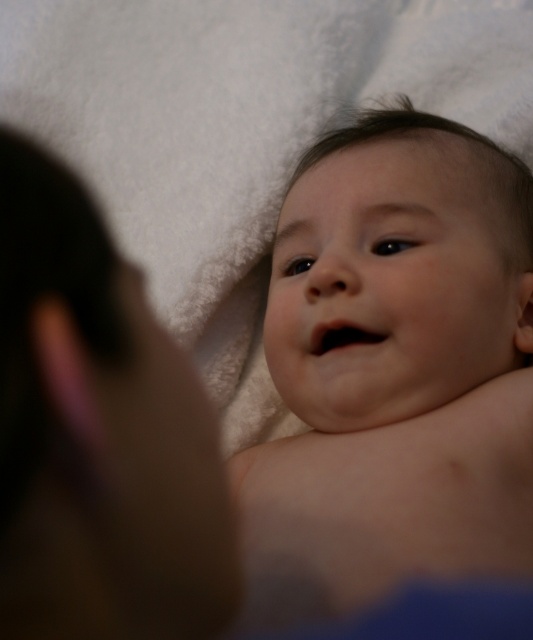
Does smooth skin baby at center have a greater height compared to brown skin at left?

Yes.

Between point (314, 310) and point (12, 525), which one is positioned behind?

Positioned behind is point (314, 310).

Is point (432, 394) positioned behind point (12, 401)?

Yes, point (432, 394) is farther from viewer.

The image size is (533, 640). Identify the location of smooth skin baby at center. (393, 371).